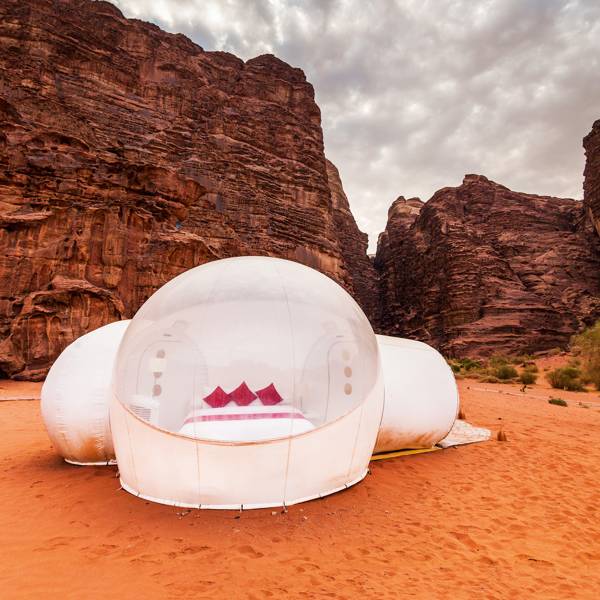
Image resolution: width=600 pixels, height=600 pixels. I want to click on comforter, so click(x=242, y=429).